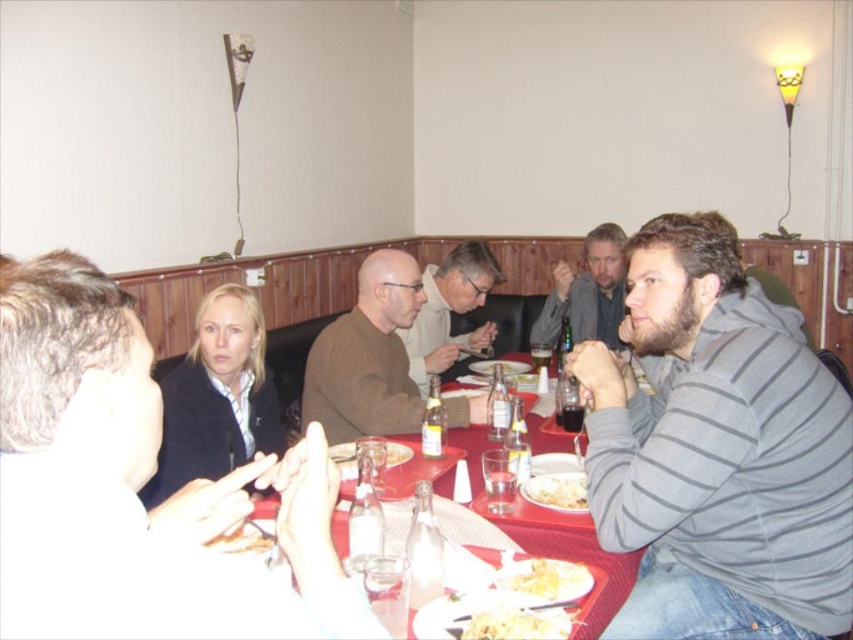
You are a server in a restaurant and need to place a new dish on the table. The dish is too large to fit between the brown wool sweater at upper left and the white fluffy pasta at center. Which object should you move to make space?

The brown wool sweater at upper left is larger in size than the white fluffy pasta at center, so you should move the brown wool sweater at upper left to make space.

Consider the image. You are a server in a restaurant trying to place a new drink order on the table. There is a gray striped hoodie at right and a matte brown sweater at center on the table. Which item should you move to make space, and why?

You should move the gray striped hoodie at right because it occupies less space than the matte brown sweater at center, making it easier to relocate to create space for the drink order.

You are a server at this restaurant and need to deliver a drink to the person wearing the gray striped hoodie at right. The drink must be placed on the table within 15 inches of the yellowish matte pasta at lower center. Can you place the drink close enough to the pasta without exceeding the 15 inches limit?

The gray striped hoodie at right is 15.11 inches from the yellowish matte pasta at lower center. Since the required distance is within 15 inches, the server can place the drink within the 15 inches limit by positioning it closer to the pasta, ensuring it stays under the specified distance.